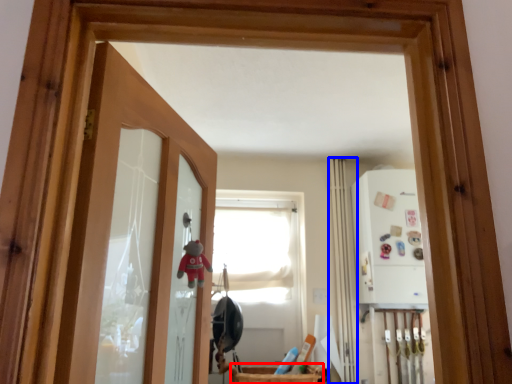
Question: Which object is further to the camera taking this photo, basket (highlighted by a red box) or curtain (highlighted by a blue box)?

Choices:
 (A) basket
 (B) curtain

Answer: (B)